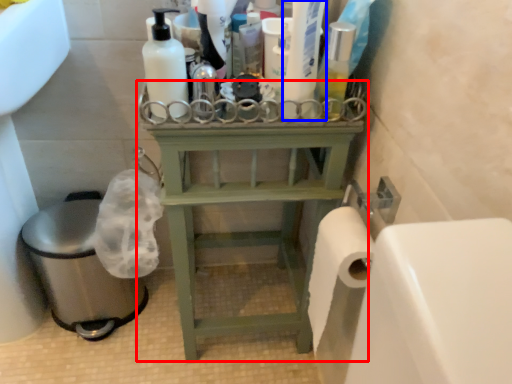
Question: Among these objects, which one is nearest to the camera, furniture (highlighted by a red box) or cleaning product (highlighted by a blue box)?

Choices:
 (A) furniture
 (B) cleaning product

Answer: (B)